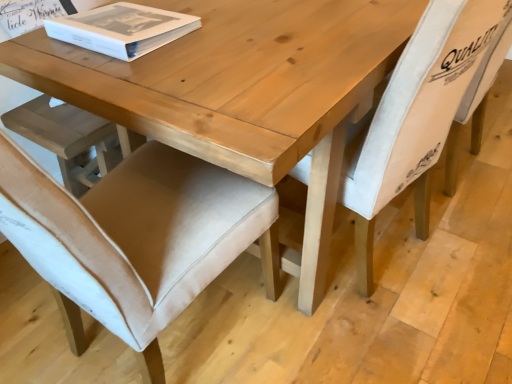
This screenshot has height=384, width=512. Find the location of `unoccupied region to the right of beige fabric chair at lower left, marked as the 1th chair in a left-to-right arrangement`. unoccupied region to the right of beige fabric chair at lower left, marked as the 1th chair in a left-to-right arrangement is located at coordinates (317, 336).